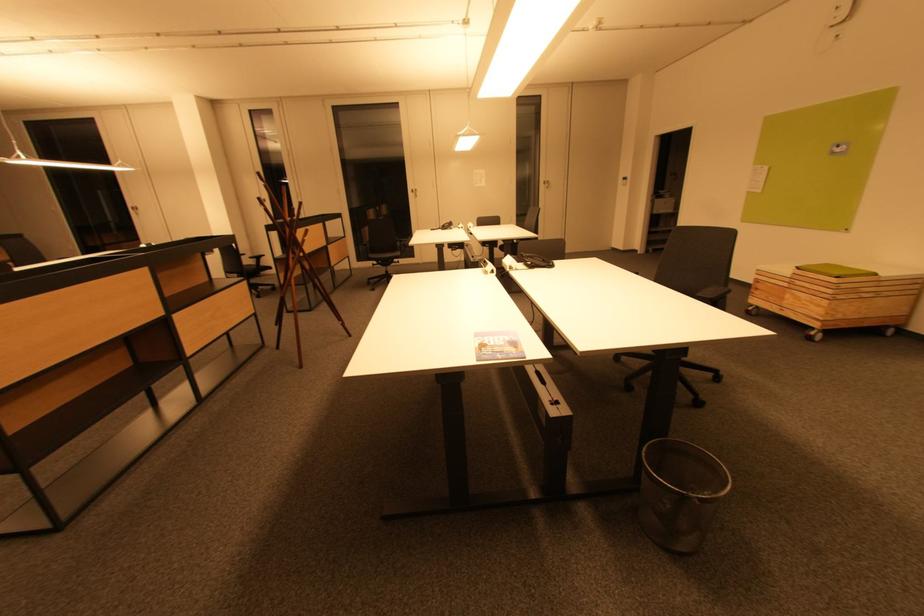
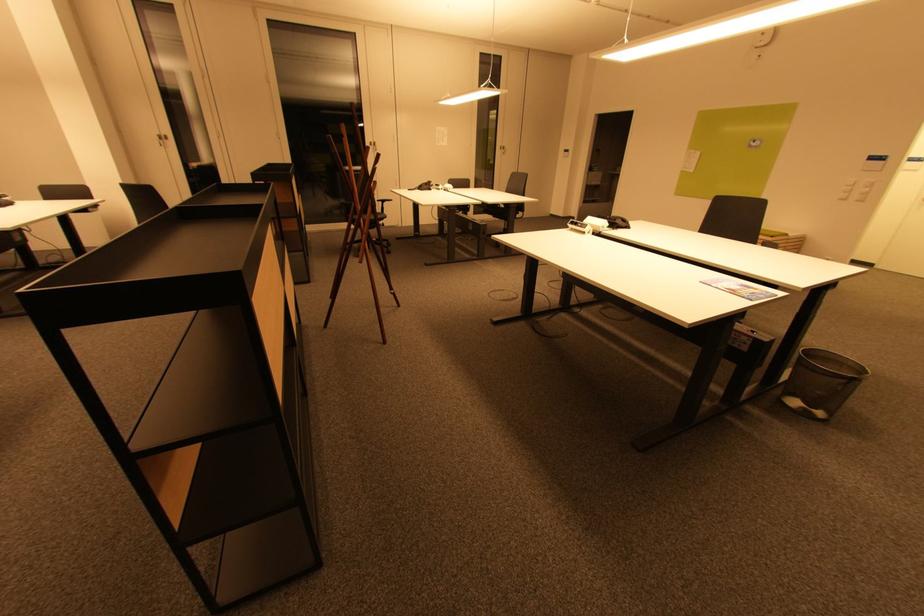
The point at (x=842, y=276) is marked in the first image. Where is the corresponding point in the second image?

(775, 236)